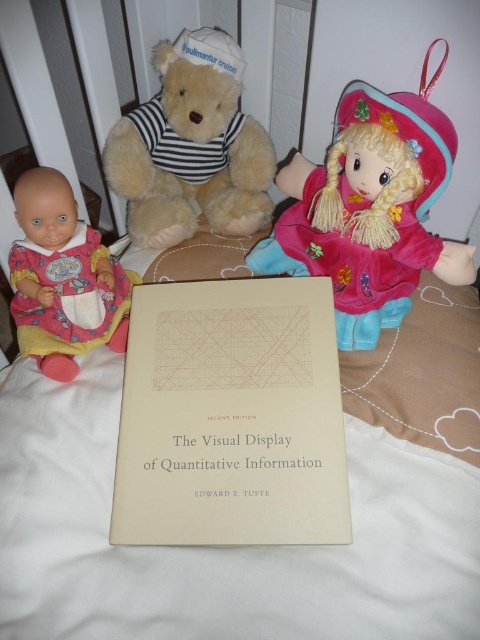
Can you confirm if beige paper book at center is shorter than fluffy beige teddy bear at upper center?

Indeed, beige paper book at center has a lesser height compared to fluffy beige teddy bear at upper center.

Can you confirm if beige paper book at center is positioned to the right of fluffy beige teddy bear at upper center?

Yes, beige paper book at center is to the right of fluffy beige teddy bear at upper center.

Identify the location of beige paper book at center. This screenshot has height=640, width=480. (230, 417).

Is beige paper book at center to the left of matte pink fabric baby doll at left from the viewer's perspective?

In fact, beige paper book at center is to the right of matte pink fabric baby doll at left.

Is point (264, 380) in front of point (48, 198)?

Yes, point (264, 380) is closer to viewer.

This screenshot has height=640, width=480. I want to click on beige paper book at center, so click(230, 417).

The height and width of the screenshot is (640, 480). I want to click on beige paper book at center, so click(230, 417).

Which of these two, velvety pink doll at upper right or fluffy beige teddy bear at upper center, stands taller?

With more height is velvety pink doll at upper right.

Who is more distant from viewer, (381, 140) or (191, 44)?

Point (191, 44)

Image resolution: width=480 pixels, height=640 pixels. I want to click on velvety pink doll at upper right, so click(x=370, y=209).